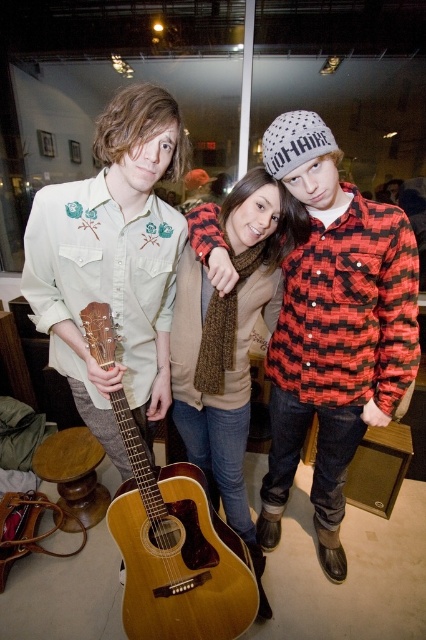
You are organizing a photo shoot and need to ensure that the red plaid shirt at center and the light brown wooden guitar at center are visible in the frame. Based on their sizes, which object should you prioritize positioning closer to the camera to ensure both are fully visible?

The red plaid shirt at center is larger in size than the light brown wooden guitar at center, so you should prioritize positioning the red plaid shirt at center closer to the camera to ensure both are fully visible.

You are a fashion stylist observing the people in the image. You notice the matte light green shirt at center and the brown knitted scarf at center. Which of these two items is smaller in size?

The matte light green shirt at center is smaller than the brown knitted scarf at center.